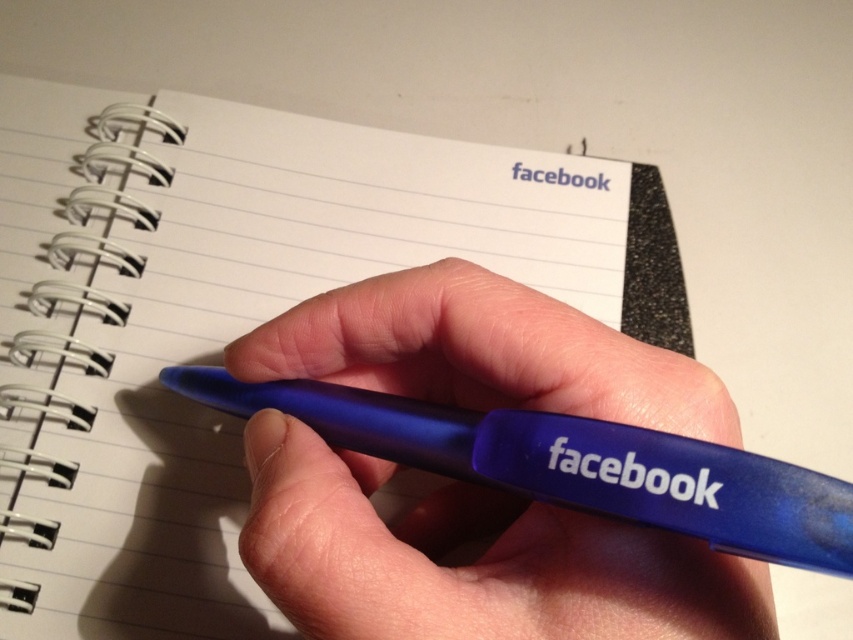
Does white paper notebook at center lie behind blue rubberized pen at center?

Yes, white paper notebook at center is behind blue rubberized pen at center.

Who is taller, white paper notebook at center or blue rubberized pen at center?

With more height is white paper notebook at center.

Locate an element on the screen. white paper notebook at center is located at coordinates (225, 317).